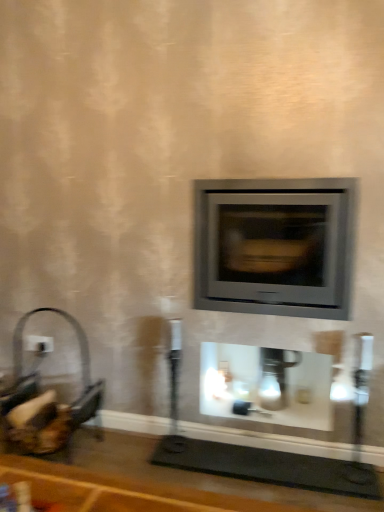
Question: Can you confirm if matte gray wood burning stove at center is bigger than white glossy fireplace at center?

Choices:
 (A) yes
 (B) no

Answer: (A)

Question: Considering the relative sizes of matte gray wood burning stove at center and white glossy fireplace at center in the image provided, is matte gray wood burning stove at center wider than white glossy fireplace at center?

Choices:
 (A) yes
 (B) no

Answer: (B)

Question: Is matte gray wood burning stove at center at the right side of white glossy fireplace at center?

Choices:
 (A) yes
 (B) no

Answer: (B)

Question: From the image's perspective, is matte gray wood burning stove at center located above white glossy fireplace at center?

Choices:
 (A) yes
 (B) no

Answer: (A)

Question: Is matte gray wood burning stove at center further to the viewer compared to white glossy fireplace at center?

Choices:
 (A) no
 (B) yes

Answer: (A)

Question: Based on their sizes in the image, would you say white glossy fireplace at center is bigger or smaller than matte gray wood burning stove at center?

Choices:
 (A) small
 (B) big

Answer: (A)

Question: Do you think white glossy fireplace at center is within matte gray wood burning stove at center, or outside of it?

Choices:
 (A) inside
 (B) outside

Answer: (B)

Question: From a real-world perspective, relative to matte gray wood burning stove at center, is white glossy fireplace at center vertically above or below?

Choices:
 (A) above
 (B) below

Answer: (B)

Question: Considering the positions of white glossy fireplace at center and matte gray wood burning stove at center in the image, is white glossy fireplace at center taller or shorter than matte gray wood burning stove at center?

Choices:
 (A) tall
 (B) short

Answer: (B)

Question: Looking at their shapes, would you say matte gray wood burning stove at center is wider or thinner than white plastic electric outlet at left?

Choices:
 (A) wide
 (B) thin

Answer: (A)

Question: In terms of height, does matte gray wood burning stove at center look taller or shorter compared to white plastic electric outlet at left?

Choices:
 (A) short
 (B) tall

Answer: (B)

Question: Do you think matte gray wood burning stove at center is within white plastic electric outlet at left, or outside of it?

Choices:
 (A) inside
 (B) outside

Answer: (B)

Question: In the image, is matte gray wood burning stove at center positioned in front of or behind white plastic electric outlet at left?

Choices:
 (A) behind
 (B) front

Answer: (B)

Question: In the image, is white plastic electric outlet at left positioned in front of or behind white glossy fireplace at center?

Choices:
 (A) behind
 (B) front

Answer: (A)

Question: Choose the correct answer: Is white plastic electric outlet at left inside white glossy fireplace at center or outside it?

Choices:
 (A) outside
 (B) inside

Answer: (A)